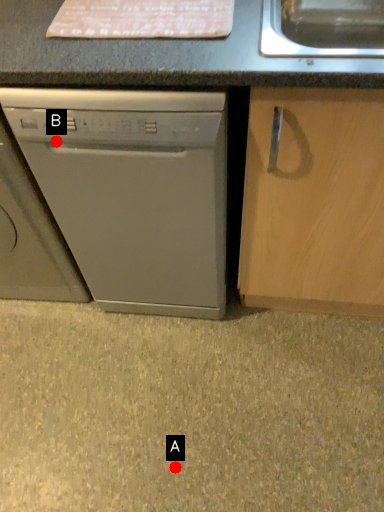
Question: Two points are circled on the image, labeled by A and B beside each circle. Among these points, which one is nearest to the camera?

Choices:
 (A) A is closer
 (B) B is closer

Answer: (B)